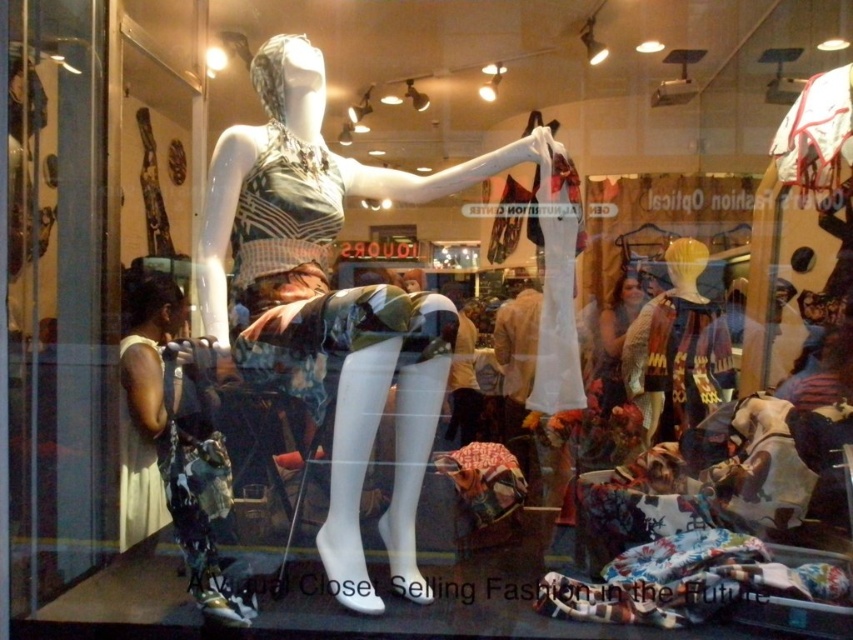
Which is in front, point (239, 346) or point (131, 536)?

Point (239, 346) is in front.

Is point (323, 163) more distant than point (119, 474)?

That is True.

Image resolution: width=853 pixels, height=640 pixels. I want to click on matte white mannequin at center, so click(x=329, y=304).

The height and width of the screenshot is (640, 853). In order to click on matte white mannequin at center in this screenshot , I will do `click(329, 304)`.

Does point (238, 618) come farther from viewer compared to point (618, 317)?

No, it is not.

Where is `printed fabric dress at left`? printed fabric dress at left is located at coordinates (181, 435).

Which is below, textured beige scarf at center or matte gold necklace at center?

textured beige scarf at center

Does textured beige scarf at center have a lesser height compared to matte gold necklace at center?

Incorrect, textured beige scarf at center's height does not fall short of matte gold necklace at center's.

Where is `textured beige scarf at center`? The image size is (853, 640). textured beige scarf at center is located at coordinates (675, 362).